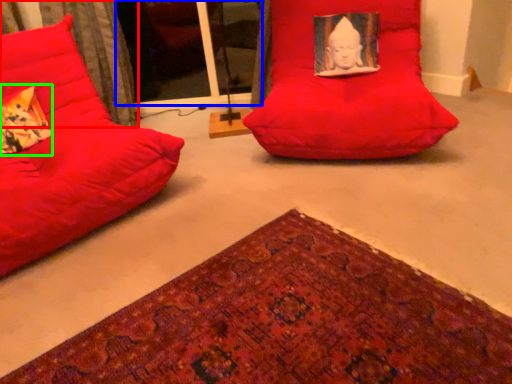
Question: Based on their relative distances, which object is farther from curtain (highlighted by a red box)? Choose from glass door (highlighted by a blue box) and throw pillow (highlighted by a green box).

Choices:
 (A) glass door
 (B) throw pillow

Answer: (A)